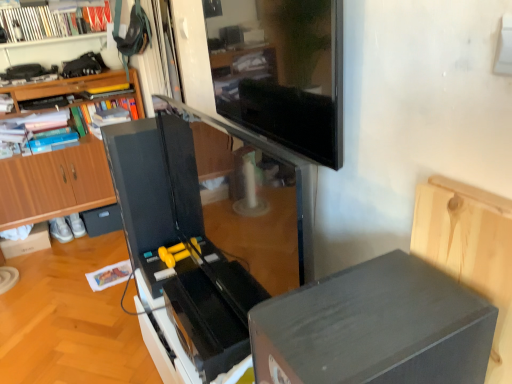
Find the location of a particular element. vacant space situated above matte black speaker at lower right (from a real-world perspective) is located at coordinates (370, 312).